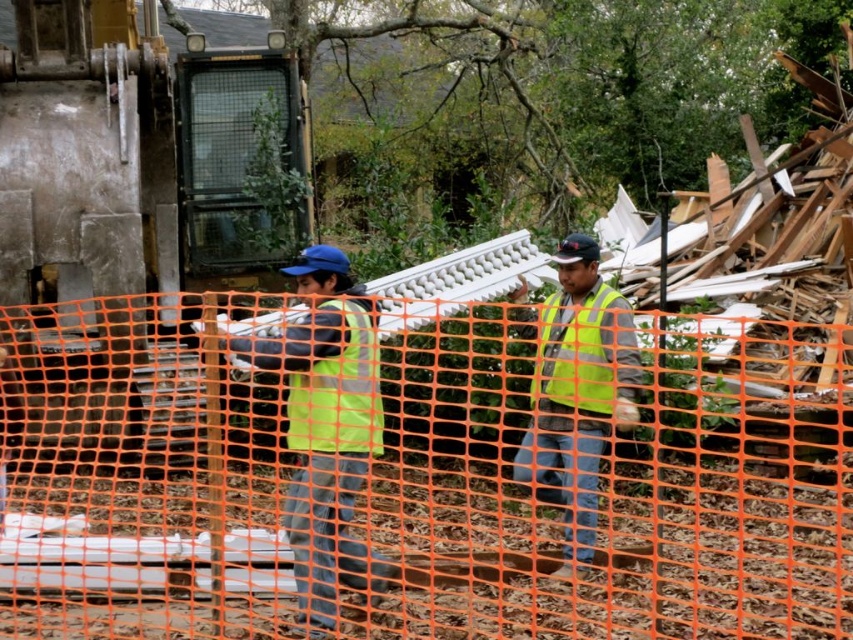
Question: From the image, what is the correct spatial relationship of orange mesh fence at center in relation to yellow reflective safety vest at center?

Choices:
 (A) below
 (B) above

Answer: (A)

Question: Which point is closer to the camera?

Choices:
 (A) (583, 356)
 (B) (630, 385)

Answer: (B)

Question: Which of the following is the farthest from the observer?

Choices:
 (A) yellow reflective safety vest at center
 (B) orange mesh fence at center

Answer: (A)

Question: Which point is closer to the camera?

Choices:
 (A) (601, 308)
 (B) (352, 465)
 (C) (289, 444)
 (D) (608, 288)

Answer: (B)

Question: Can you confirm if high-visibility yellow safety vest at center is positioned above yellow reflective safety vest at center?

Choices:
 (A) no
 (B) yes

Answer: (A)

Question: Observing the image, what is the correct spatial positioning of high-visibility yellow vest at center in reference to high-visibility yellow safety vest at center?

Choices:
 (A) right
 (B) left

Answer: (B)